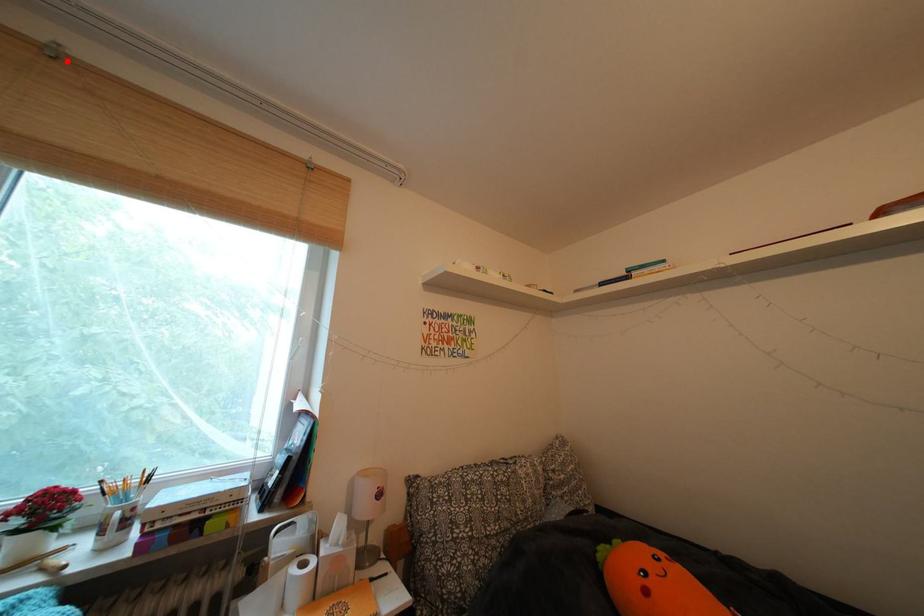
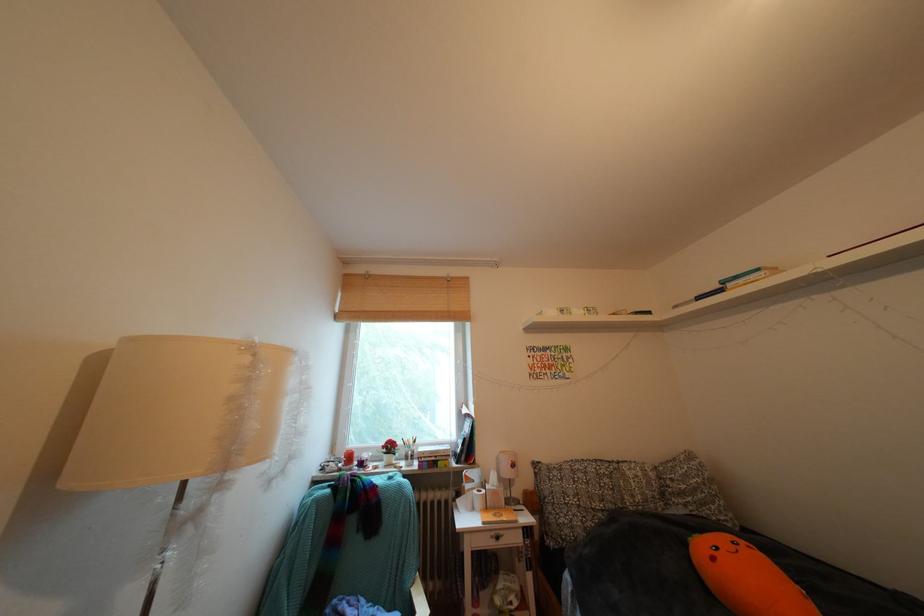
Question: I am providing you with two images of the same scene from different viewpoints. A red point is marked on the first image. Can you still see the location of the red point in image 2?

Choices:
 (A) Yes
 (B) No

Answer: (A)